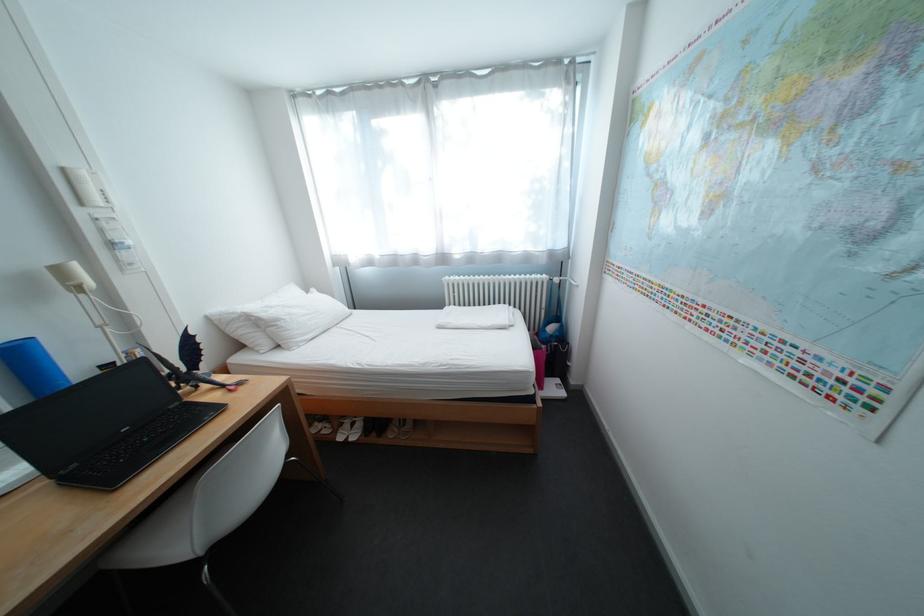
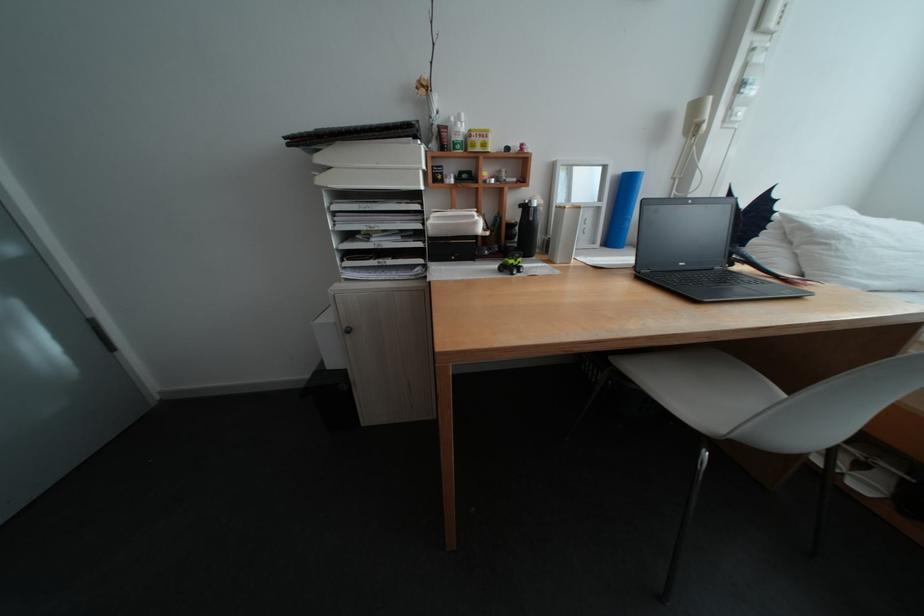
First-person continuous shooting, in which direction is the camera rotating?

The camera rotated toward left-down.